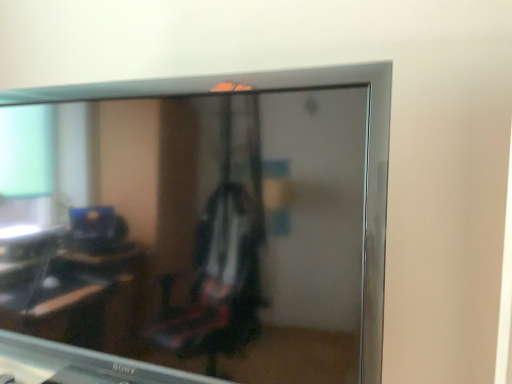
Measure the distance between matte black television at upper center and camera.

They are 25.02 inches apart.

Identify the location of matte black television at upper center. Image resolution: width=512 pixels, height=384 pixels. (196, 229).

Image resolution: width=512 pixels, height=384 pixels. What do you see at coordinates (196, 229) in the screenshot? I see `matte black television at upper center` at bounding box center [196, 229].

This screenshot has width=512, height=384. I want to click on matte black television at upper center, so click(196, 229).